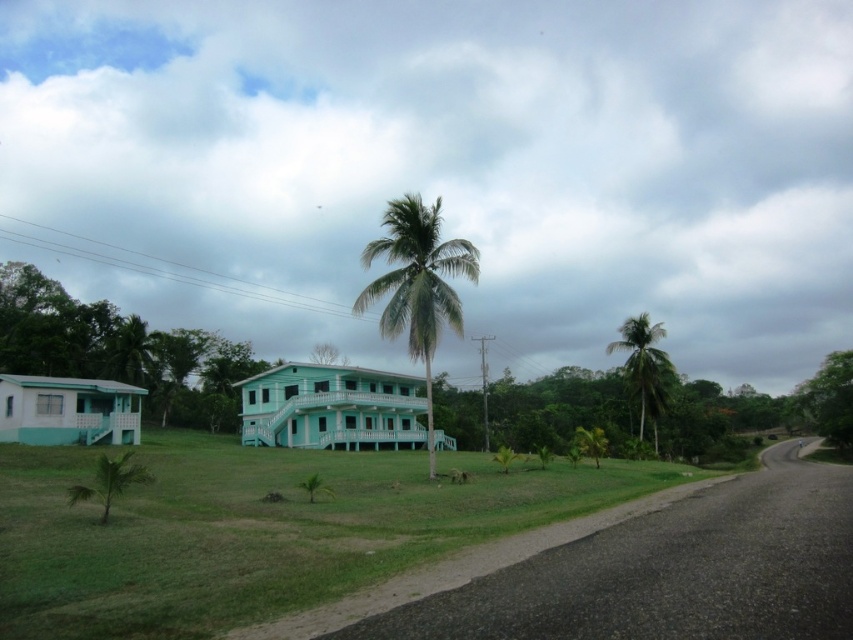
You are a landscape architect planning to plant more palm trees along the road in the scene. Given the space between the green leafy palm at center and the green leafy palm tree at right, can you determine which one has a narrower canopy width?

The green leafy palm at center has a lesser width compared to the green leafy palm tree at right, so the green leafy palm at center has a narrower canopy width.

You are a landscape architect planning to plant new trees along the road in this rural scene. You have two palm trees to place. The first is the green leafy palm at center, and the second is the green leafy palm tree at right. Based on their heights, which palm tree would you choose to place closer to the road to ensure it doesn not block the view of the house on the left?

The green leafy palm tree at right is shorter, so placing it closer to the road would prevent blocking the view of the house on the left while allowing the taller green leafy palm at center to be positioned further back.